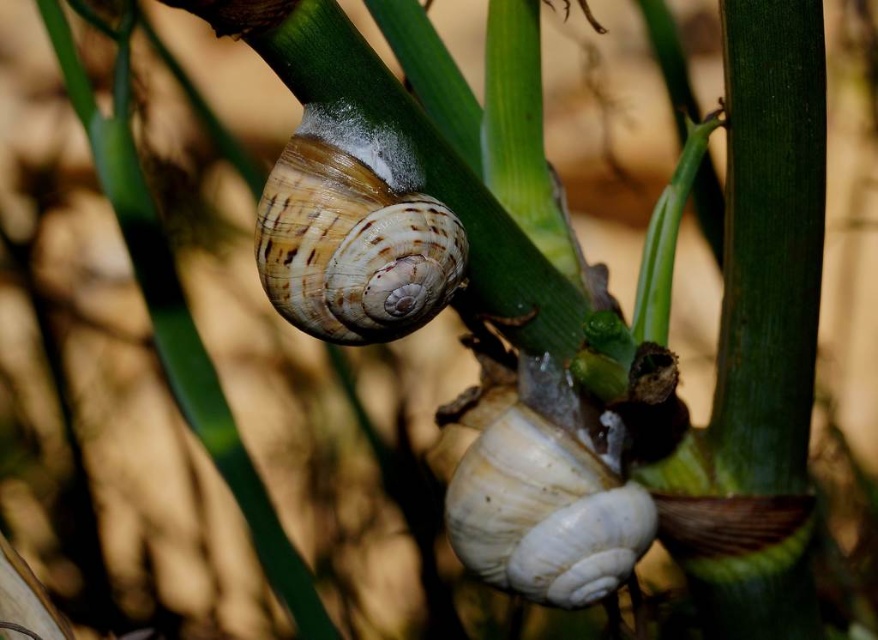
Question: Which point is farther to the camera?

Choices:
 (A) (379, 253)
 (B) (498, 483)

Answer: (B)

Question: Does brown striped shell at center appear over white matte snail at center?

Choices:
 (A) yes
 (B) no

Answer: (A)

Question: Is brown striped shell at center to the right of white matte snail at center from the viewer's perspective?

Choices:
 (A) no
 (B) yes

Answer: (A)

Question: Does brown striped shell at center have a smaller size compared to white matte snail at center?

Choices:
 (A) yes
 (B) no

Answer: (A)

Question: Which point is closer to the camera?

Choices:
 (A) (581, 564)
 (B) (335, 177)

Answer: (B)

Question: Which object is farther from the camera taking this photo?

Choices:
 (A) brown striped shell at center
 (B) white matte snail at center

Answer: (B)